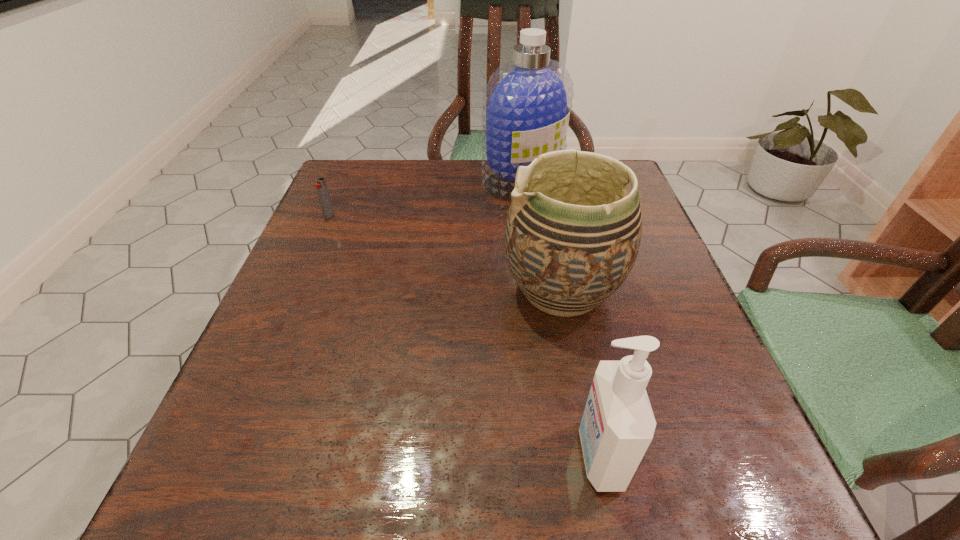
Find the location of a particular element. vacant space located 0.380m on the front label of the shorter cleansing agent is located at coordinates (300, 456).

The height and width of the screenshot is (540, 960). In order to click on vacant area situated on the front label of the shorter cleansing agent in this screenshot , I will do point(540,456).

Find the location of a particular element. blank space located on the right of the leftmost object is located at coordinates (450, 215).

This screenshot has width=960, height=540. Find the location of `object that is at the far edge`. object that is at the far edge is located at coordinates (526, 104).

Find the location of `object at the near edge`. object at the near edge is located at coordinates (618, 424).

In order to click on object at the left edge in this screenshot , I will do `click(321, 187)`.

Locate an element on the screen. The image size is (960, 540). object that is positioned at the right edge is located at coordinates (572, 236).

The height and width of the screenshot is (540, 960). In the image, there is a desktop. Identify the location of vacant space at the far edge. (457, 199).

You are a GUI agent. You are given a task and a screenshot of the screen. Output one action in this format:
    pyautogui.click(x=<x>, y=<y>)
    Task: Click on the free region at the near edge
    The image size is (960, 540).
    Given the screenshot: What is the action you would take?
    pyautogui.click(x=521, y=500)

This screenshot has height=540, width=960. Find the location of `vacant space at the left edge of the desktop`. vacant space at the left edge of the desktop is located at coordinates (300, 355).